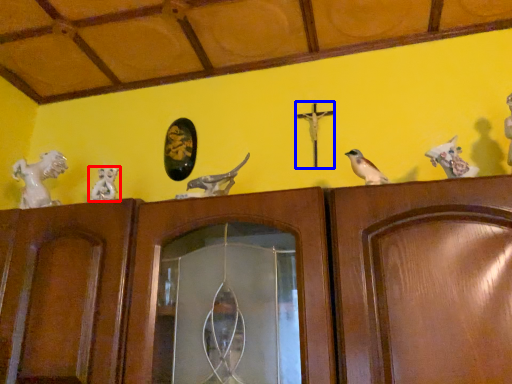
Question: Which of the following is the closest to the observer, animal (highlighted by a red box) or crucifix (highlighted by a blue box)?

Choices:
 (A) animal
 (B) crucifix

Answer: (A)